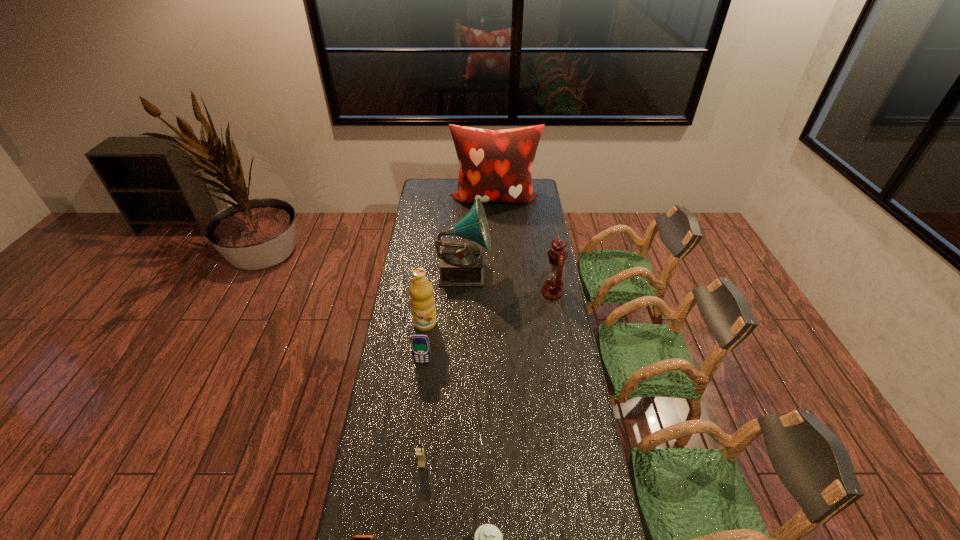
At what (x,y) coordinates should I click in order to perform the action: click on blank space at the right edge. Please return your answer as a coordinate pair (x, y). Image resolution: width=960 pixels, height=540 pixels. Looking at the image, I should click on click(600, 511).

This screenshot has height=540, width=960. I want to click on free space that is in between the sixth farthest object and the fourth shortest object, so click(422, 414).

The height and width of the screenshot is (540, 960). What are the coordinates of `unoccupied area between the oil lamp and the cushion` in the screenshot? It's located at (523, 246).

I want to click on object that stands as the seventh closest to the leftmost cellular telephone, so click(x=495, y=166).

Locate an element on the screen. The width and height of the screenshot is (960, 540). object that stands as the sixth closest to the farthest cellular telephone is located at coordinates [357, 539].

Select which cellular telephone is the second closest to the second farthest cellular telephone. Please provide its 2D coordinates. Your answer should be formatted as a tuple, i.e. [(x, y)], where the tuple contains the x and y coordinates of a point satisfying the conditions above.

[(420, 346)]

This screenshot has width=960, height=540. In order to click on cellular telephone that is the third nearest to the olive oil in this screenshot , I will do `click(357, 539)`.

This screenshot has height=540, width=960. I want to click on vacant position in the image that satisfies the following two spatial constraints: 1. on the horn of the record player; 2. on the front-facing side of the fourth shortest object, so click(460, 363).

What are the coordinates of `free spot that satisfies the following two spatial constraints: 1. on the horn of the record player; 2. on the back side of the oil lamp` in the screenshot? It's located at (463, 292).